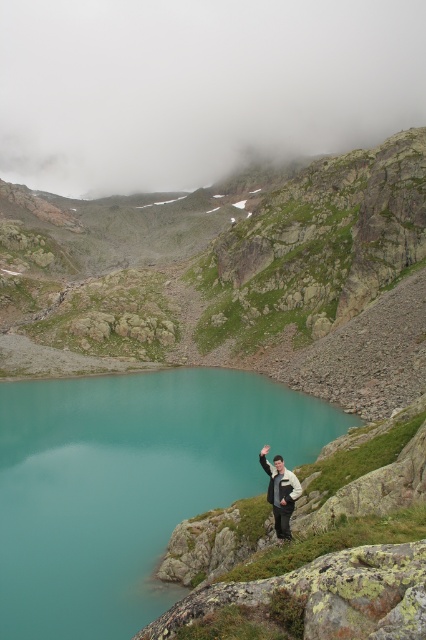
Does teal glassy lake at center have a smaller size compared to white fleece jacket at lower right?

No.

Does point (17, 568) come behind point (284, 508)?

That is True.

This screenshot has height=640, width=426. Find the location of `teal glassy lake at center`. teal glassy lake at center is located at coordinates (129, 484).